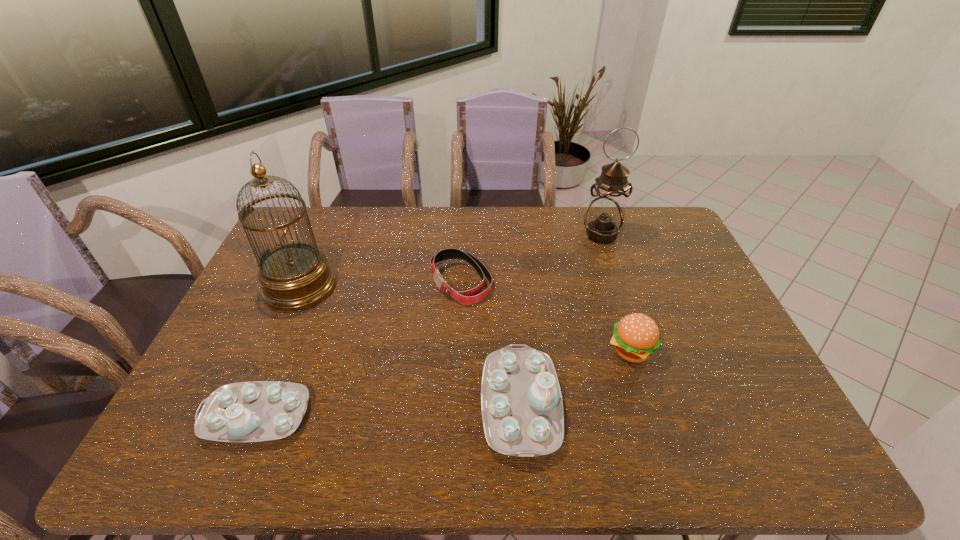
I want to click on vacant space located on the back of the hamburger, so click(x=617, y=307).

Identify the location of free location located 0.360m with an open door on the birdcage. (449, 287).

At what (x,y) coordinates should I click in order to perform the action: click on object that is at the far edge. Please return your answer as a coordinate pair (x, y). Looking at the image, I should click on (603, 219).

The height and width of the screenshot is (540, 960). I want to click on chinaware present at the left edge, so click(x=254, y=411).

Where is `birdcage that is positioned at the left edge`? birdcage that is positioned at the left edge is located at coordinates (294, 276).

Locate an element on the screen. Image resolution: width=960 pixels, height=540 pixels. object present at the near left corner is located at coordinates (254, 411).

This screenshot has width=960, height=540. Identify the location of vacant space at the far edge of the desktop. (482, 227).

In the image, there is a desktop. In order to click on vacant space at the left edge in this screenshot , I will do `click(272, 347)`.

Locate an element on the screen. The height and width of the screenshot is (540, 960). free space at the right edge of the desktop is located at coordinates (703, 374).

At what (x,y) coordinates should I click in order to perform the action: click on free space at the far right corner. Please return your answer as a coordinate pair (x, y). The height and width of the screenshot is (540, 960). Looking at the image, I should click on click(x=661, y=230).